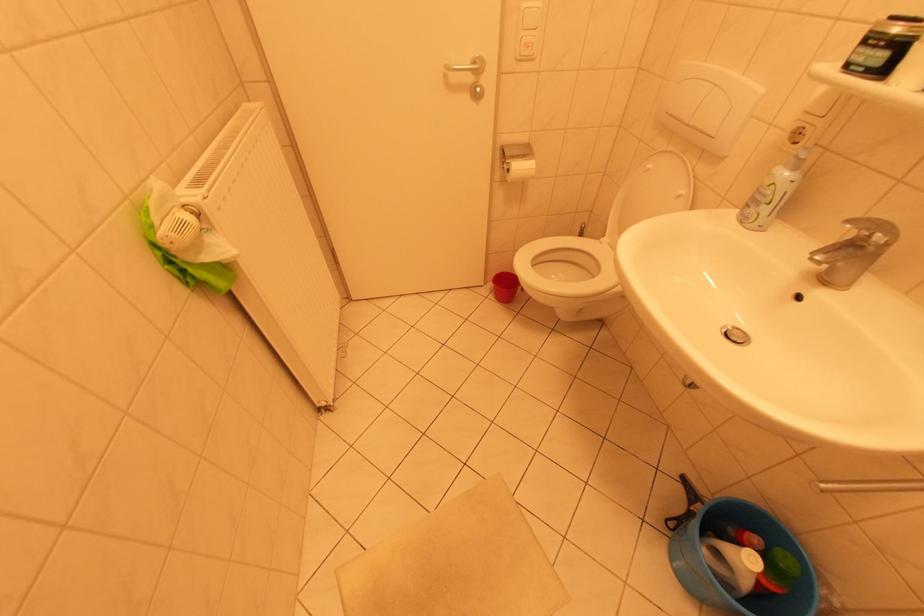
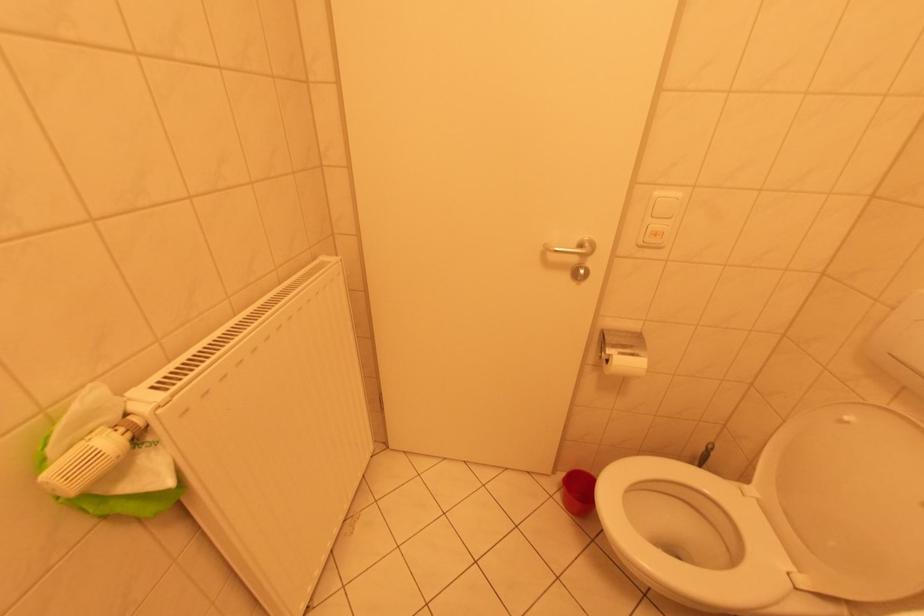
Question: In a continuous first-person perspective shot, in which direction is the camera moving?

Choices:
 (A) Left
 (B) Right
 (C) Forward
 (D) Backward

Answer: (C)